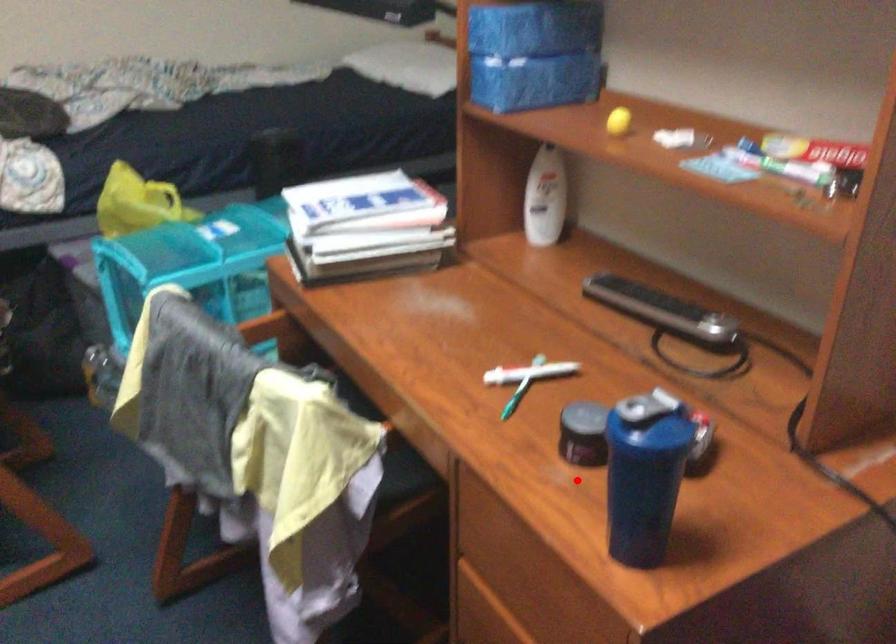
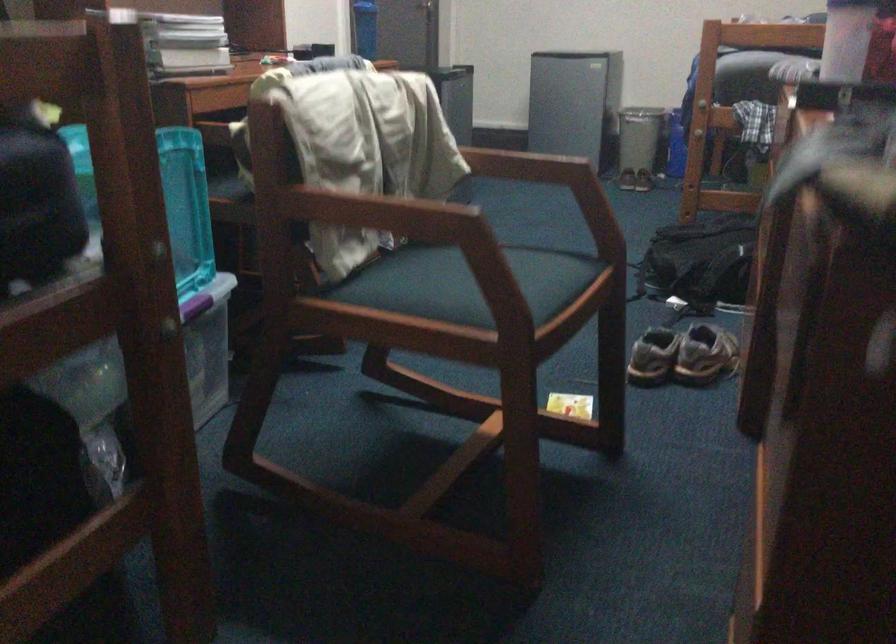
Locate, in the second image, the point that corresponds to the highlighted location in the first image.

(365, 28)